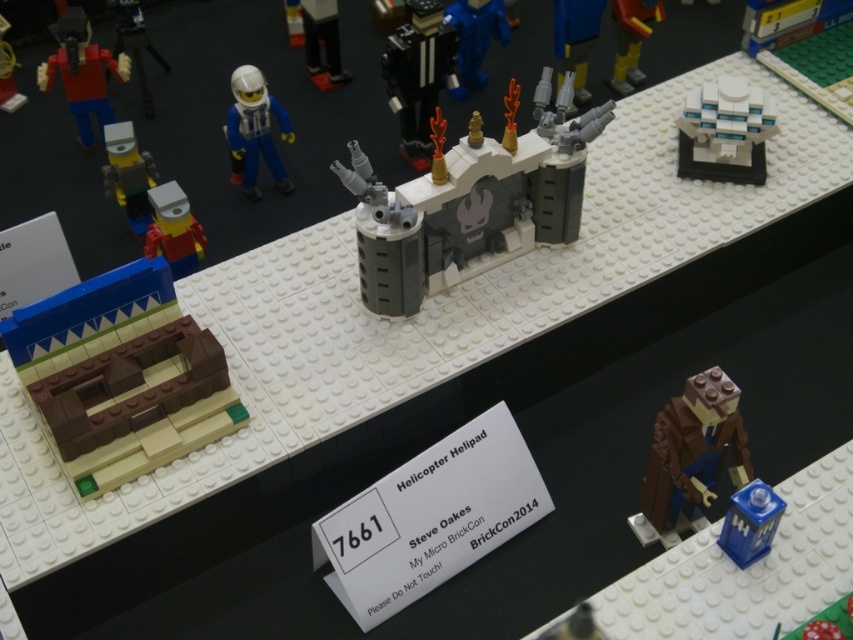
Question: In this image, where is black plastic rocket at center located relative to matte red minifigure at center-left?

Choices:
 (A) above
 (B) below

Answer: (A)

Question: Among these objects, which one is nearest to the camera?

Choices:
 (A) black plastic rocket at center
 (B) black plastic figure at upper center

Answer: (A)

Question: Which object is the farthest from the white plastic building at upper right?

Choices:
 (A) blue plastic figure at upper center
 (B) black plastic rocket at center

Answer: (B)

Question: Does gray metallic bridge at center appear on the right side of brown matte figure at lower right?

Choices:
 (A) yes
 (B) no

Answer: (B)

Question: Can you confirm if blue plastic figure at upper center is positioned above matte white astronaut at upper left?

Choices:
 (A) yes
 (B) no

Answer: (A)

Question: Which is farther from the matte yellow minifigure at left?

Choices:
 (A) brown matte building at lower left
 (B) matte black helmet at upper left
 (C) black plastic rocket at center

Answer: (C)